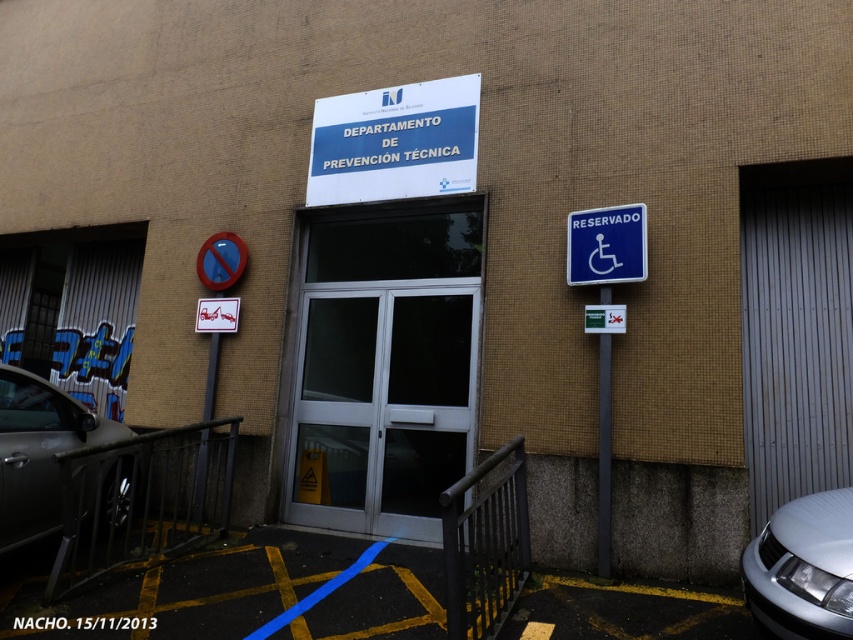
Measure the distance from silver metallic car at lower right to blue plastic sign at right.

silver metallic car at lower right is 4.52 feet away from blue plastic sign at right.

Does silver metallic car at lower right have a greater height compared to blue plastic sign at right?

Incorrect, silver metallic car at lower right's height is not larger of blue plastic sign at right's.

Where is `silver metallic car at lower right`? This screenshot has width=853, height=640. silver metallic car at lower right is located at coordinates (804, 568).

Between silver metallic car at lower right and shiny black car at lower left, which one has less height?

Standing shorter between the two is silver metallic car at lower right.

Image resolution: width=853 pixels, height=640 pixels. I want to click on silver metallic car at lower right, so (804, 568).

Looking at this image, between white plastic sign at upper center and silver metallic car at lower right, which one has less height?

Standing shorter between the two is silver metallic car at lower right.

Between white plastic sign at upper center and silver metallic car at lower right, which one is positioned lower?

Positioned lower is silver metallic car at lower right.

This screenshot has width=853, height=640. What do you see at coordinates (393, 141) in the screenshot?
I see `white plastic sign at upper center` at bounding box center [393, 141].

Where is `white plastic sign at upper center`? This screenshot has width=853, height=640. white plastic sign at upper center is located at coordinates (393, 141).